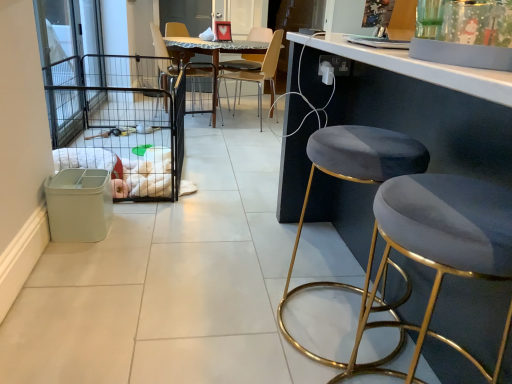
Question: Is wooden chair at center, which appears as the 2th chair when viewed from the left, in front of or behind velvet/golden stool at right, the second stool positioned from the back, in the image?

Choices:
 (A) behind
 (B) front

Answer: (A)

Question: From the image's perspective, relative to velvet/golden stool at right, the second stool positioned from the back, is wooden chair at center, which is counted as the 1th chair, starting from the right, above or below?

Choices:
 (A) above
 (B) below

Answer: (A)

Question: Which object is the closest to the clear glass screen door at left?

Choices:
 (A) wooden chair at center, which appears as the 2th chair when viewed from the left
 (B) metallic brown chair at upper center, which ranks as the first chair in left-to-right order
 (C) velvet/golden stool at right, the 1th stool in the front-to-back sequence
 (D) velvet/golden stool at right, the 1th stool in the back-to-front sequence
 (E) black wire cage at left

Answer: (E)

Question: Which object is the farthest from the metallic brown chair at upper center, the second chair positioned from the right?

Choices:
 (A) wooden chair at center, which appears as the 2th chair when viewed from the left
 (B) velvet/golden stool at right, positioned as the second stool in front-to-back order
 (C) velvet/golden stool at right, the 1th stool in the front-to-back sequence
 (D) black wire cage at left
 (E) clear glass screen door at left

Answer: (C)